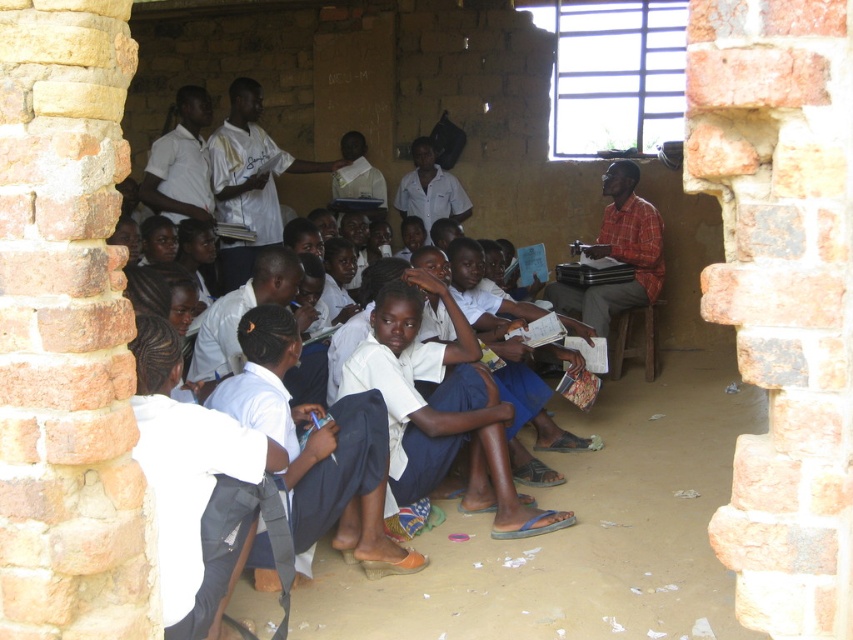
Question: Is brick at left to the right of white shirt at center from the viewer's perspective?

Choices:
 (A) no
 (B) yes

Answer: (B)

Question: Can you confirm if white cotton shirt at center is wider than white shirt at center?

Choices:
 (A) yes
 (B) no

Answer: (A)

Question: Which object appears closest to the camera in this image?

Choices:
 (A) white cotton shirt at center
 (B) brick at left

Answer: (B)

Question: Which of the following is the farthest from the observer?

Choices:
 (A) white cotton shirt at center
 (B) white shirt at center

Answer: (B)

Question: Which point is closer to the camera taking this photo?

Choices:
 (A) (77, 248)
 (B) (283, 150)
 (C) (496, 410)

Answer: (A)

Question: Can you confirm if white cotton shirt at center is positioned to the left of white shirt at center?

Choices:
 (A) no
 (B) yes

Answer: (A)